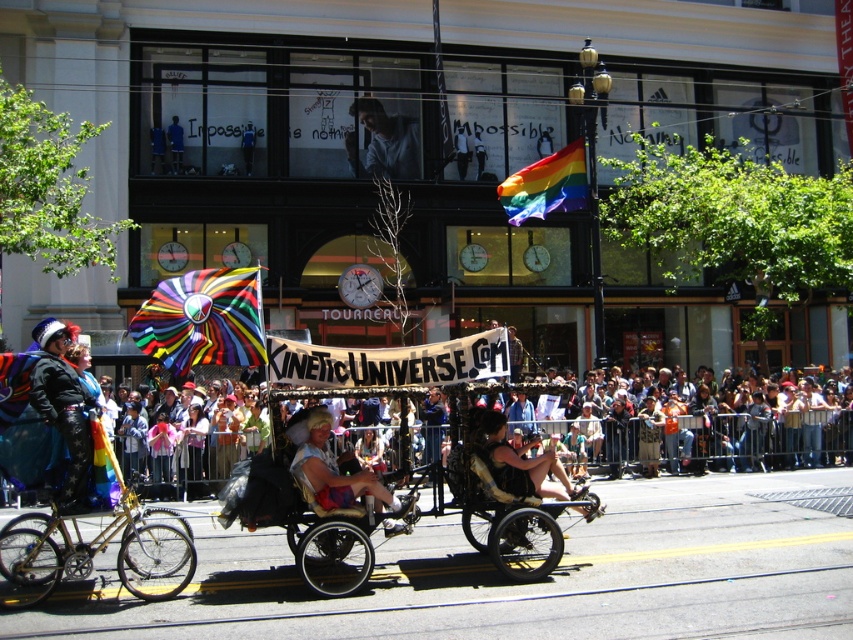
You are a photographer standing in front of the float. You want to take a photo that includes both the metallic gold tricycle at center and the leather jacket at center. What is the minimum distance you need to step back to ensure both objects are in frame?

The metallic gold tricycle at center and the leather jacket at center are 90.42 centimeters apart. To capture both in the frame, you need to step back at least 90.42 centimeters to ensure the camera can encompass the distance between them.

You are a photographer trying to capture a clear shot of both the shiny metallic helmet at left and the blonde hair wig at center. Since you want to ensure both are visible in your frame, which object should you focus on first to account for their height differences?

The shiny metallic helmet at left is taller than the blonde hair wig at center, so you should focus on the shiny metallic helmet at left first to ensure its height doesn

Looking at this image, you are a photographer standing in the crowd watching the parade. You want to take a photo of the metallic gold tricycle at center and the leather jacket at center. Based on their positions, which object should you focus on first to ensure both are in the frame?

The metallic gold tricycle at center is in front of the leather jacket at center, so you should focus on the leather jacket at center first to ensure both are in the frame.